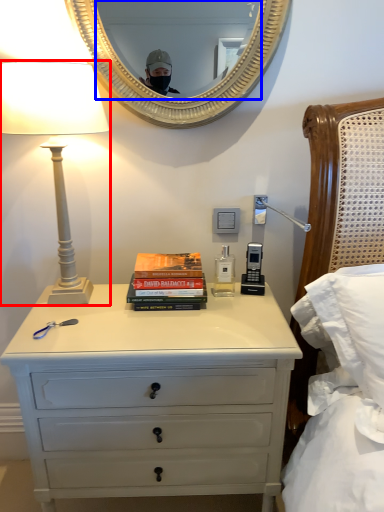
Question: Which object appears closest to the camera in this image, lamp (highlighted by a red box) or mirror (highlighted by a blue box)?

Choices:
 (A) lamp
 (B) mirror

Answer: (A)